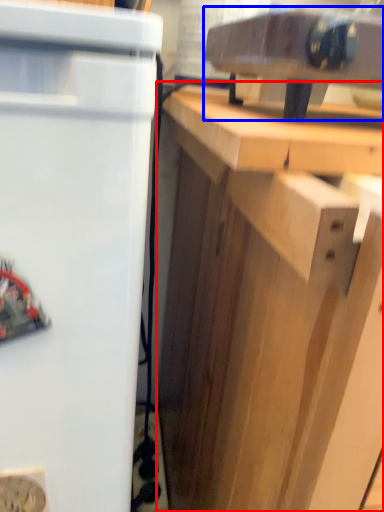
Question: Which object appears closest to the camera in this image, cabinetry (highlighted by a red box) or appliance (highlighted by a blue box)?

Choices:
 (A) cabinetry
 (B) appliance

Answer: (A)